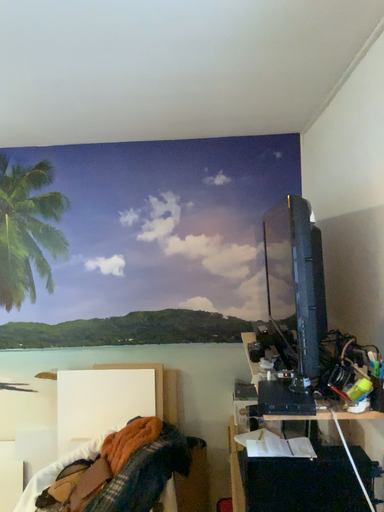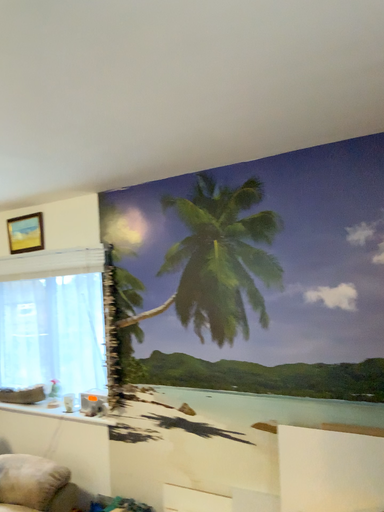
Question: How did the camera likely rotate when shooting the video?

Choices:
 (A) rotated right
 (B) rotated left

Answer: (B)